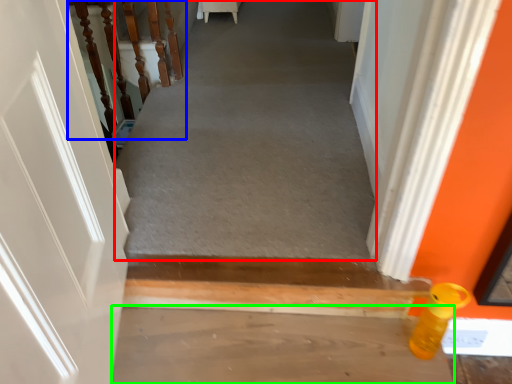
Question: Which object is positioned closest to passage (highlighted by a red box)? Select from stairwell (highlighted by a blue box) and concrete (highlighted by a green box).

Choices:
 (A) stairwell
 (B) concrete

Answer: (A)